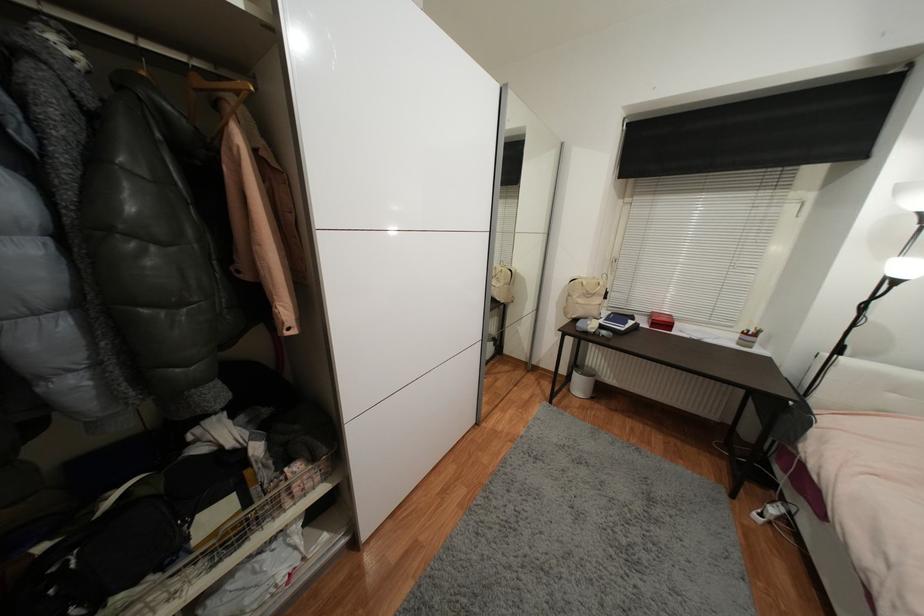
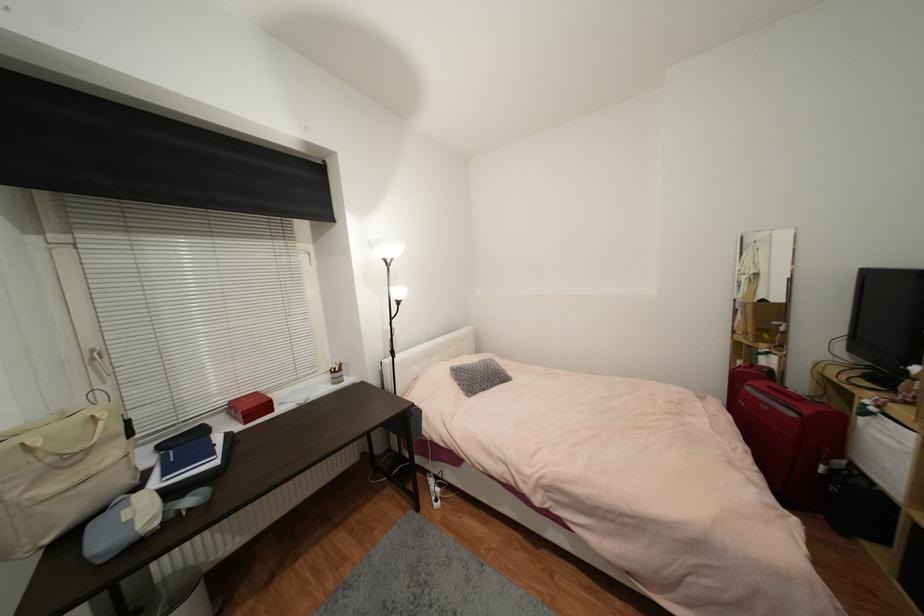
Question: Based on the continuous images, in which direction is the camera rotating? Reply with the corresponding letter.

Choices:
 (A) Left
 (B) Right
 (C) Up
 (D) Down

Answer: (B)